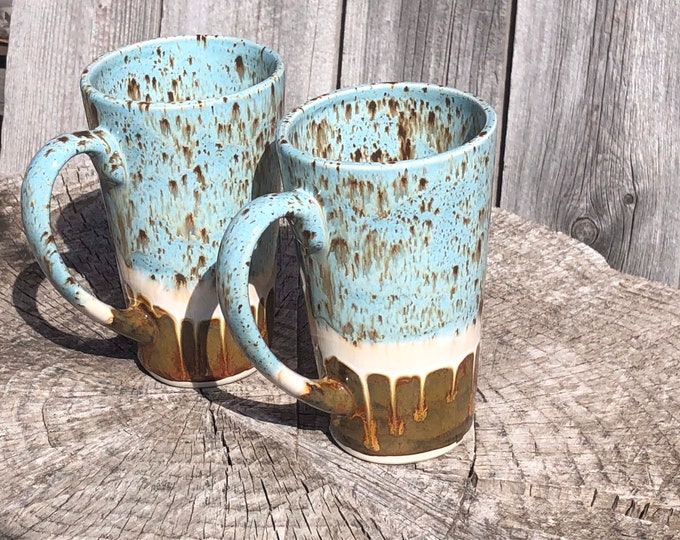
Where is `handle`? Image resolution: width=680 pixels, height=540 pixels. handle is located at coordinates (39, 243).